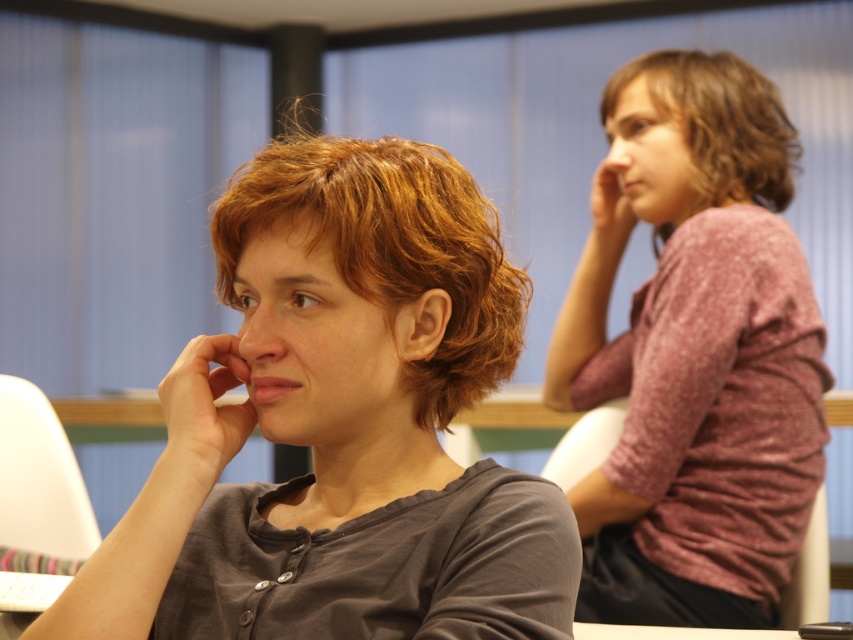
You are an interior designer assessing the spatial arrangement of the room. You notice the dark gray matte shirt at center and the matte skin nose at center. Which object has a greater width?

The dark gray matte shirt at center has a greater width than the matte skin nose at center according to the description.

You are standing in the room and want to hand a note to the person wearing the matte pink shirt at right. Based on their position in the scene, which direction should you walk to approach them?

The matte pink shirt at right is located at point (697, 358), so you should walk towards the right side of the room to approach them.